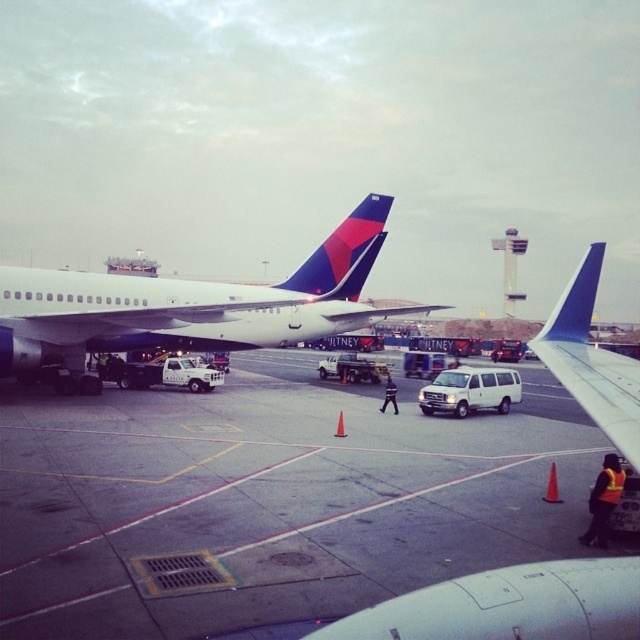
You are a passenger on an airplane and you want to know which object is nearer to you between the smooth asphalt tarmac at center and the white matte van at center. Based on the scene, which one is closer?

The smooth asphalt tarmac at center is closer to the viewer than the white matte van at center.

You are a passenger disembarking from the Delta Air Lines aircraft and need to reach the white matte van at center. Based on the scene, which direction should you walk relative to the smooth asphalt tarmac at center?

The smooth asphalt tarmac at center is to the left of the white matte van at center, so you should walk to the right relative to the smooth asphalt tarmac at center to reach the white matte van at center.

You are a ground crew member who needs to ensure there is enough space between the matte blue airplane at center and the edge of the smooth asphalt tarmac at center. According to the scene, which object is wider?

The smooth asphalt tarmac at center is wider than the matte blue airplane at center, so there is sufficient space between the airplane and the edge of the tarmac.